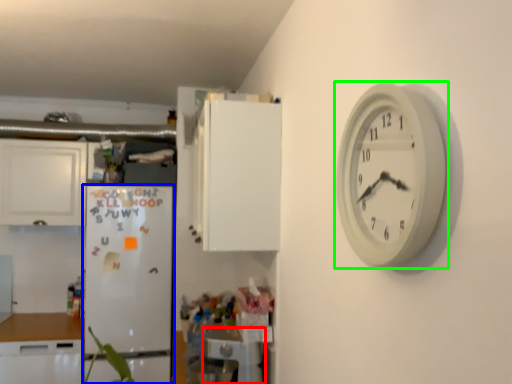
Question: Which object is positioned farthest from appliance (highlighted by a red box)? Select from fridge (highlighted by a blue box) and wall clock (highlighted by a green box).

Choices:
 (A) fridge
 (B) wall clock

Answer: (B)